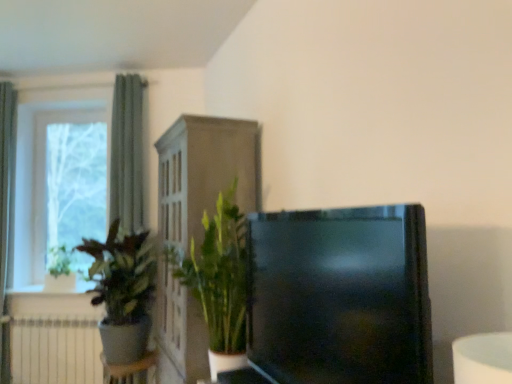
This screenshot has width=512, height=384. I want to click on green fabric curtain at left, the 1th curtain when ordered from right to left, so click(x=127, y=153).

Image resolution: width=512 pixels, height=384 pixels. I want to click on green leafy plant at center, arranged as the first houseplant when viewed from the right, so click(x=218, y=278).

What do you see at coordinates (340, 296) in the screenshot? I see `black glossy tv at center` at bounding box center [340, 296].

Identify the location of green fabric curtain at left, the first curtain in the left-to-right sequence. (7, 185).

From the image's perspective, is green fabric curtain at left, the 1th curtain when ordered from right to left, above white matte radiator at lower left?

Yes, from the image's perspective, green fabric curtain at left, the 1th curtain when ordered from right to left, is on top of white matte radiator at lower left.

Is green fabric curtain at left, positioned as the second curtain in left-to-right order, in front of white matte radiator at lower left?

Yes, green fabric curtain at left, positioned as the second curtain in left-to-right order, is in front of white matte radiator at lower left.

Looking at this image, is green fabric curtain at left, the 1th curtain when ordered from right to left, taller or shorter than white matte radiator at lower left?

green fabric curtain at left, the 1th curtain when ordered from right to left, is taller than white matte radiator at lower left.

Is green fabric curtain at left, positioned as the second curtain in left-to-right order, thinner than white matte radiator at lower left?

No, green fabric curtain at left, positioned as the second curtain in left-to-right order, is not thinner than white matte radiator at lower left.

Is white glass window at left oriented away from green matte plant at left, placed as the 1th houseplant when sorted from left to right?

No, white glass window at left is not facing away from green matte plant at left, placed as the 1th houseplant when sorted from left to right.

Find the location of a particular element. The height and width of the screenshot is (384, 512). window frame located behind the green matte plant at left, acting as the 2th houseplant starting from the right is located at coordinates (68, 181).

Looking at this image, who is smaller, white glass window at left or green matte plant at left, placed as the 1th houseplant when sorted from left to right?

With smaller size is white glass window at left.

From the image's perspective, is white glass window at left under green matte plant at left, acting as the 2th houseplant starting from the right?

Incorrect, from the image's perspective, white glass window at left is higher than green matte plant at left, acting as the 2th houseplant starting from the right.

Is green fabric curtain at left, positioned as the second curtain in left-to-right order, a part of green leafy plant at center, positioned as the second houseplant in left-to-right order?

No.

Looking at this image, is green leafy plant at center, arranged as the first houseplant when viewed from the right, facing towards green fabric curtain at left, the 1th curtain when ordered from right to left?

No, green leafy plant at center, arranged as the first houseplant when viewed from the right, is not facing towards green fabric curtain at left, the 1th curtain when ordered from right to left.

From the image's perspective, is green leafy plant at center, arranged as the first houseplant when viewed from the right, positioned above or below green fabric curtain at left, the 1th curtain when ordered from right to left?

Clearly, from the image's perspective, green leafy plant at center, arranged as the first houseplant when viewed from the right, is below green fabric curtain at left, the 1th curtain when ordered from right to left.

Considering the sizes of objects white matte radiator at lower left and green fabric curtain at left, the 2th curtain viewed from the right, in the image provided, who is smaller, white matte radiator at lower left or green fabric curtain at left, the 2th curtain viewed from the right,?

Smaller between the two is white matte radiator at lower left.

Does white matte radiator at lower left lie in front of green fabric curtain at left, the 2th curtain viewed from the right?

That is False.

Could you tell me if white matte radiator at lower left is facing green fabric curtain at left, the first curtain in the left-to-right sequence?

No, white matte radiator at lower left does not turn towards green fabric curtain at left, the first curtain in the left-to-right sequence.

Based on the photo, from a real-world perspective, is white matte radiator at lower left positioned under green fabric curtain at left, the first curtain in the left-to-right sequence, based on gravity?

Yes.

Considering the positions of objects white matte radiator at lower left and white glossy window sill at lower left in the image provided, who is in front, white matte radiator at lower left or white glossy window sill at lower left?

white matte radiator at lower left.

Choose the correct answer: Is white matte radiator at lower left inside white glossy window sill at lower left or outside it?

white matte radiator at lower left is located beyond the bounds of white glossy window sill at lower left.

Is white matte radiator at lower left next to white glossy window sill at lower left?

white matte radiator at lower left and white glossy window sill at lower left are not in contact.

Looking at the image, does white glass window at left seem bigger or smaller compared to black glossy tv at center?

Clearly, white glass window at left is smaller in size than black glossy tv at center.

Between white glass window at left and black glossy tv at center, which one has smaller width?

white glass window at left.

Is white glass window at left next to black glossy tv at center?

They are not placed beside each other.

Where is `television that is under the white glass window at left (from a real-world perspective)`? The width and height of the screenshot is (512, 384). television that is under the white glass window at left (from a real-world perspective) is located at coordinates (340, 296).

Considering the sizes of black glossy tv at center and white matte radiator at lower left in the image, is black glossy tv at center wider or thinner than white matte radiator at lower left?

In the image, black glossy tv at center appears to be wider than white matte radiator at lower left.

From the image's perspective, which object appears higher, black glossy tv at center or white matte radiator at lower left?

black glossy tv at center, from the image's perspective.

Is black glossy tv at center to the left or to the right of white matte radiator at lower left in the image?

From the image, it's evident that black glossy tv at center is to the right of white matte radiator at lower left.

Would you say black glossy tv at center contains white matte radiator at lower left?

No, white matte radiator at lower left is not surrounded by black glossy tv at center.

The height and width of the screenshot is (384, 512). I want to click on radiator below the green fabric curtain at left, positioned as the second curtain in left-to-right order (from the image's perspective), so click(55, 350).

Locate an element on the screen. The image size is (512, 384). window frame lying on the left of green matte plant at left, placed as the 1th houseplant when sorted from left to right is located at coordinates (68, 181).

When comparing their distances from black glossy tv at center, does green matte plant at left, acting as the 2th houseplant starting from the right, or green leafy plant at center, positioned as the second houseplant in left-to-right order, seem closer?

green leafy plant at center, positioned as the second houseplant in left-to-right order, lies closer to black glossy tv at center than the other object.

Consider the image. Based on their spatial positions, is green fabric curtain at left, the first curtain in the left-to-right sequence, or black glossy tv at center closer to green matte plant at left, acting as the 2th houseplant starting from the right?

green fabric curtain at left, the first curtain in the left-to-right sequence, is closer to green matte plant at left, acting as the 2th houseplant starting from the right.

When comparing their distances from white matte radiator at lower left, does white glass window at left or green fabric curtain at left, the 1th curtain when ordered from right to left, seem closer?

The object closer to white matte radiator at lower left is white glass window at left.

Looking at the image, which one is located further to white glass window at left, white matte radiator at lower left or white glossy window sill at lower left?

white matte radiator at lower left lies further to white glass window at left than the other object.

Based on their spatial positions, is green leafy plant at center, positioned as the second houseplant in left-to-right order, or white glass window at left closer to black glossy tv at center?

green leafy plant at center, positioned as the second houseplant in left-to-right order, is positioned closer to the anchor black glossy tv at center.

Based on their spatial positions, is black glossy tv at center or green matte plant at left, placed as the 1th houseplant when sorted from left to right, further from green fabric curtain at left, the 1th curtain when ordered from right to left?

black glossy tv at center is further to green fabric curtain at left, the 1th curtain when ordered from right to left.

Looking at the image, which one is located closer to white glossy window sill at lower left, white matte radiator at lower left or green leafy plant at center, arranged as the first houseplant when viewed from the right?

white matte radiator at lower left is positioned closer to the anchor white glossy window sill at lower left.

When comparing their distances from green fabric curtain at left, the 1th curtain when ordered from right to left, does white glossy window sill at lower left or white matte radiator at lower left seem closer?

white glossy window sill at lower left.

You are a GUI agent. You are given a task and a screenshot of the screen. Output one action in this format:
    pyautogui.click(x=<x>, y=<y>)
    Task: Click on the houseplant located between green leafy plant at center, positioned as the second houseplant in left-to-right order, and white matte radiator at lower left in the depth direction
    The width and height of the screenshot is (512, 384).
    Given the screenshot: What is the action you would take?
    pyautogui.click(x=122, y=292)

The width and height of the screenshot is (512, 384). Identify the location of window frame located between green fabric curtain at left, the 2th curtain viewed from the right, and green fabric curtain at left, the 1th curtain when ordered from right to left, in the left-right direction. (68, 181).

Where is `radiator between black glossy tv at center and white glossy window sill at lower left along the z-axis`? This screenshot has width=512, height=384. radiator between black glossy tv at center and white glossy window sill at lower left along the z-axis is located at coordinates (55, 350).

Where is `radiator located between green fabric curtain at left, the 2th curtain viewed from the right, and green matte plant at left, placed as the 1th houseplant when sorted from left to right, in the left-right direction`? radiator located between green fabric curtain at left, the 2th curtain viewed from the right, and green matte plant at left, placed as the 1th houseplant when sorted from left to right, in the left-right direction is located at coordinates (55, 350).